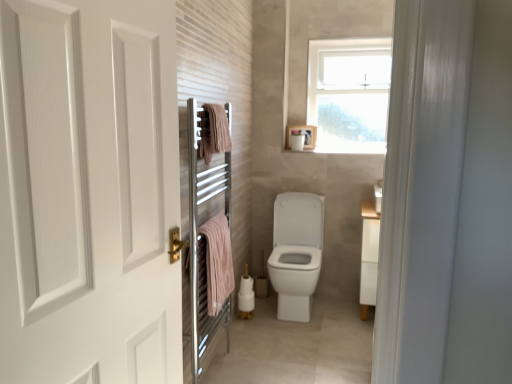
Question: Is white matte toilet paper at upper center taller or shorter than pink cotton towel at left, which is the first bath towel in bottom-to-top order?

Choices:
 (A) short
 (B) tall

Answer: (A)

Question: Looking at their shapes, would you say white matte toilet paper at upper center is wider or thinner than pink cotton towel at left, which is the first bath towel in bottom-to-top order?

Choices:
 (A) wide
 (B) thin

Answer: (A)

Question: Based on their relative distances, which object is farther from the white matte door at left?

Choices:
 (A) pink cotton towel at left, which is the first bath towel in bottom-to-top order
 (B) pink cotton towel at upper center, the first bath towel in the top-to-bottom sequence
 (C) white matte toilet paper at upper center
 (D) chrome metallic towel warmer at left

Answer: (C)

Question: Which object is the farthest from the pink cotton towel at left, which is the first bath towel in bottom-to-top order?

Choices:
 (A) white matte toilet paper at upper center
 (B) pink cotton towel at upper center, positioned as the 2th bath towel in bottom-to-top order
 (C) white matte door at left
 (D) chrome metallic towel warmer at left

Answer: (A)